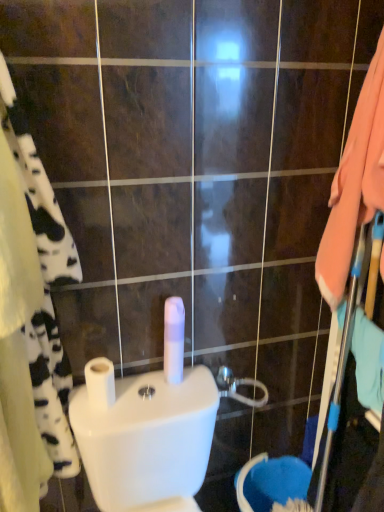
Identify the location of free space between white matte toilet paper at center, the 2th toilet paper viewed from the right, and white matte toilet paper at center, the second toilet paper from the left. This screenshot has width=384, height=512. (139, 392).